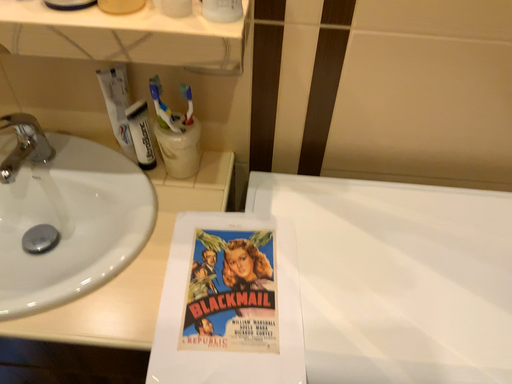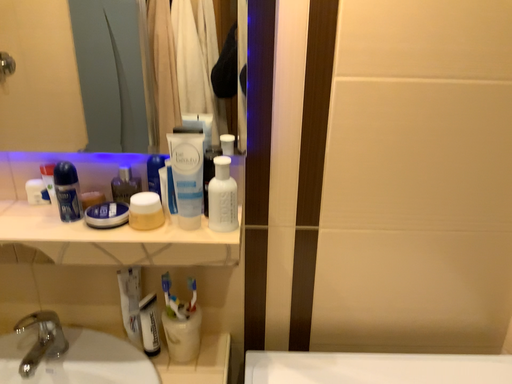
Question: Which way did the camera rotate in the video?

Choices:
 (A) rotated upward
 (B) rotated downward

Answer: (A)